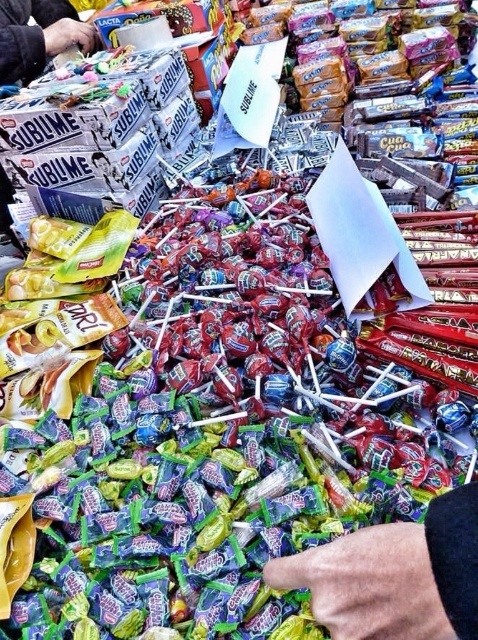
Between smooth skin hand at center and smooth plastic hand at upper left, which one has more height?

smooth plastic hand at upper left

Is smooth skin hand at center to the right of smooth plastic hand at upper left from the viewer's perspective?

Indeed, smooth skin hand at center is positioned on the right side of smooth plastic hand at upper left.

Is point (357, 593) positioned in front of point (24, 58)?

That is True.

You are a GUI agent. You are given a task and a screenshot of the screen. Output one action in this format:
    pyautogui.click(x=<x>, y=<y>)
    Task: Click on the smooth skin hand at center
    
    Given the screenshot: What is the action you would take?
    pyautogui.click(x=394, y=576)